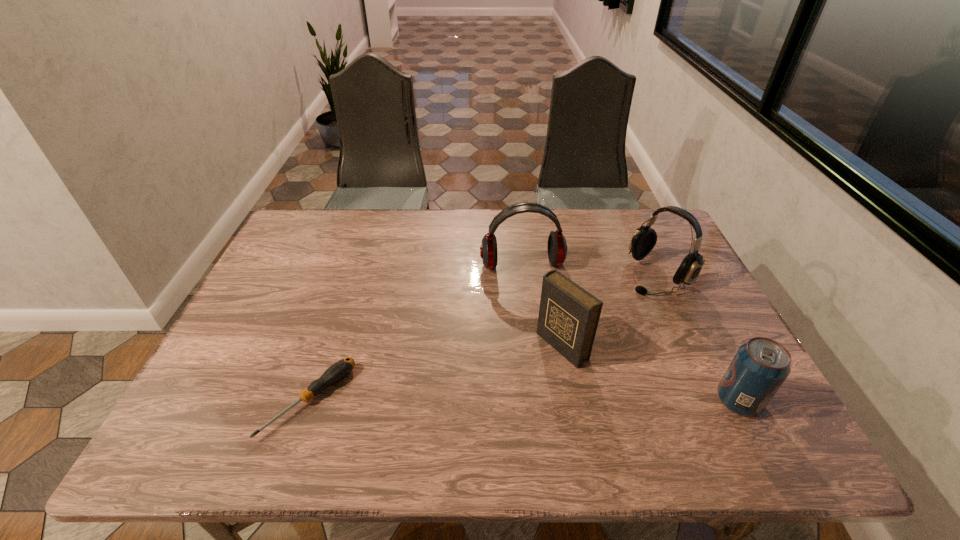
Where is `pop soda that is at the right edge`? The height and width of the screenshot is (540, 960). pop soda that is at the right edge is located at coordinates (759, 368).

This screenshot has height=540, width=960. In order to click on headset that is at the right edge in this screenshot , I will do 644,239.

Where is `object located at the near right corner`? object located at the near right corner is located at coordinates (759, 368).

At what (x,y) coordinates should I click in order to perform the action: click on vacant space at the far edge of the desktop. Please return your answer as a coordinate pair (x, y). Looking at the image, I should click on (548, 221).

Where is `vacant region at the near edge of the desktop`? This screenshot has width=960, height=540. vacant region at the near edge of the desktop is located at coordinates (594, 384).

Where is `vacant space at the left edge of the desktop`? vacant space at the left edge of the desktop is located at coordinates (303, 285).

The width and height of the screenshot is (960, 540). I want to click on vacant space at the right edge of the desktop, so click(710, 306).

The height and width of the screenshot is (540, 960). In order to click on free space at the near left corner of the desktop in this screenshot , I will do `click(204, 397)`.

Image resolution: width=960 pixels, height=540 pixels. What are the coordinates of `free space at the far right corner of the desktop` in the screenshot? It's located at [x=626, y=223].

The width and height of the screenshot is (960, 540). In order to click on empty location between the fourth tallest object and the diary in this screenshot , I will do `click(650, 374)`.